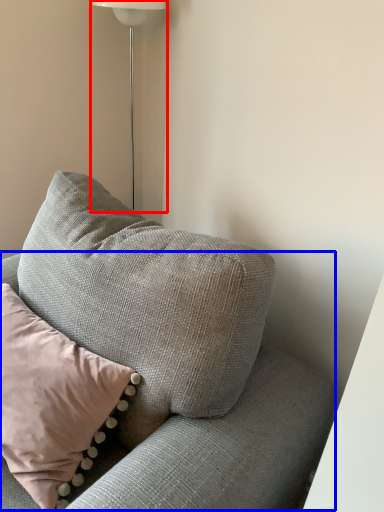
Question: Which object is further to the camera taking this photo, lamp (highlighted by a red box) or couch (highlighted by a blue box)?

Choices:
 (A) lamp
 (B) couch

Answer: (A)